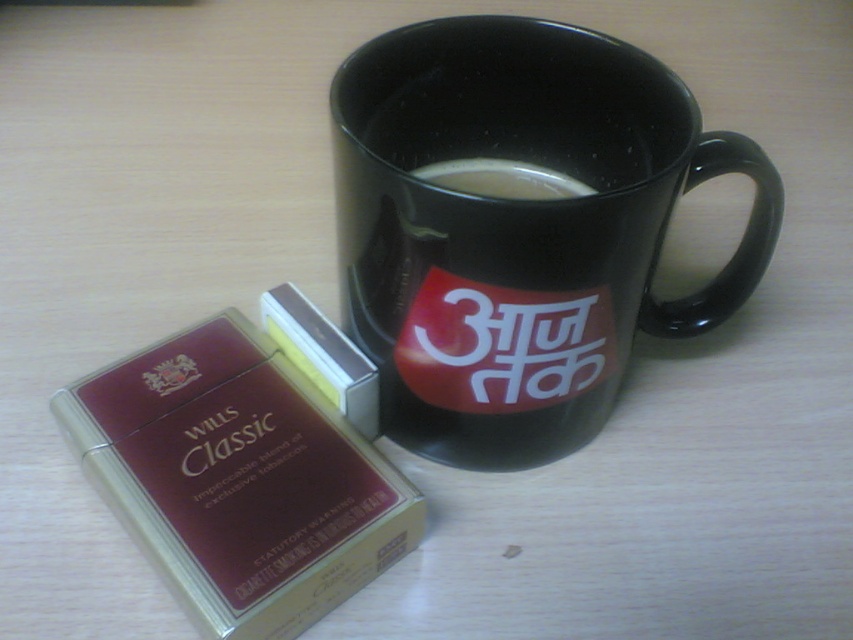
You are looking at the scene from above. Where is the black ceramic mug at upper center located in terms of coordinates?

The black ceramic mug at upper center is located at coordinates point (519, 228).

You are arranging items on a table and need to place the black ceramic mug at upper center and the white glossy coffee at upper center. According to the image, which item is positioned higher?

The white glossy coffee at upper center is positioned higher than the black ceramic mug at upper center.